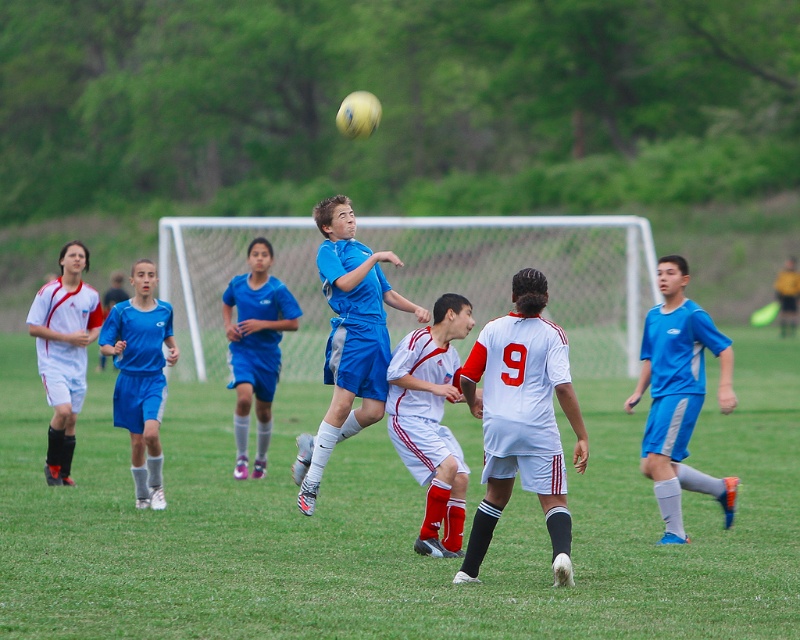
Question: Estimate the real-world distances between objects in this image. Which object is closer to the matte blue jersey at left?

Choices:
 (A) white matte soccer player at center
 (B) blue fabric soccer jersey at center
 (C) matte blue shorts at right
 (D) green grass football field at center

Answer: (B)

Question: Can you confirm if matte blue shorts at right is wider than matte blue shorts at center?

Choices:
 (A) no
 (B) yes

Answer: (A)

Question: Is blue fabric soccer jersey at center positioned behind matte blue shorts at center?

Choices:
 (A) no
 (B) yes

Answer: (A)

Question: Does blue fabric soccer jersey at center appear on the right side of matte blue jersey at left?

Choices:
 (A) yes
 (B) no

Answer: (A)

Question: Which object appears closest to the camera in this image?

Choices:
 (A) matte blue jersey at left
 (B) matte blue shorts at right
 (C) green grass football field at center

Answer: (C)

Question: Considering the real-world distances, which object is farthest from the blue fabric soccer jersey at center?

Choices:
 (A) matte blue shorts at center
 (B) matte blue jersey at left

Answer: (A)